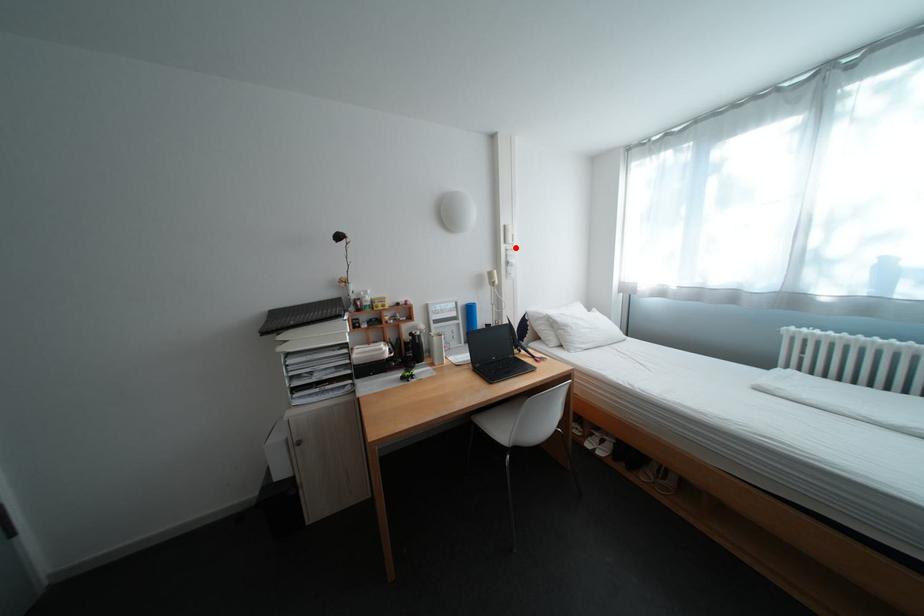
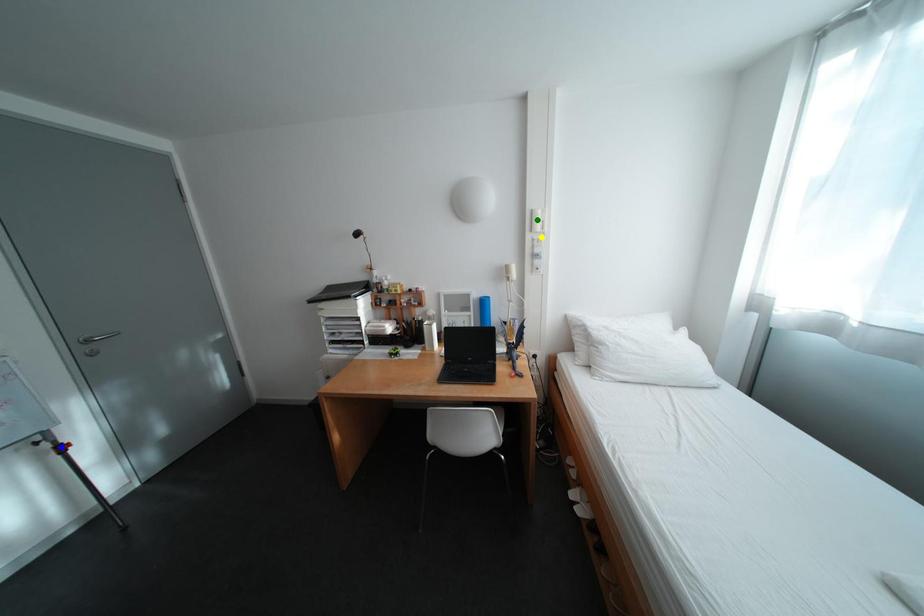
Question: I am providing you with two images of the same scene from different viewpoints. A red point is marked on the first image. You are given multiple points on the second image. In image 2, which mark is for the same physical point as the one in image 1?

Choices:
 (A) blue point
 (B) yellow point
 (C) green point

Answer: (B)